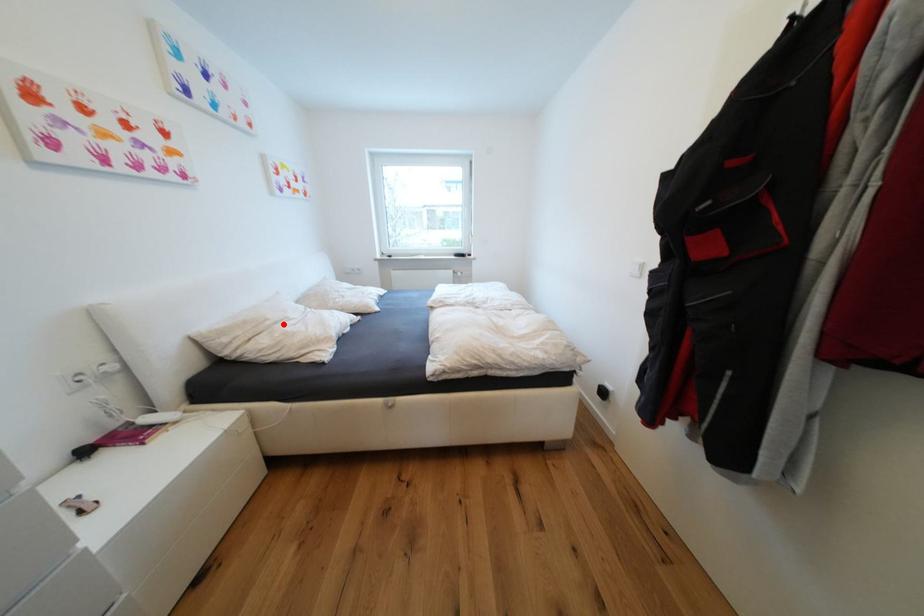
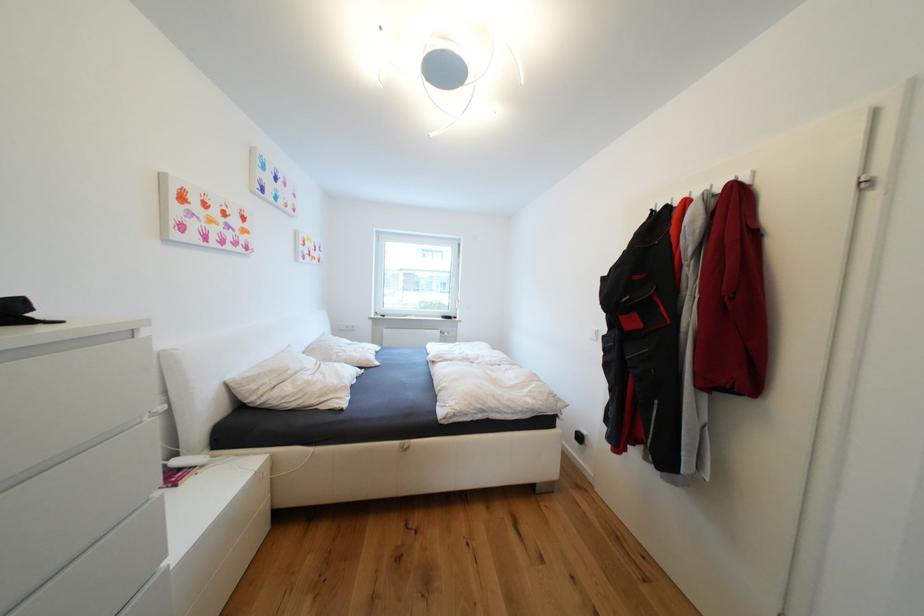
Where in the second image is the point corresponding to the highlighted location from the first image?

(304, 374)